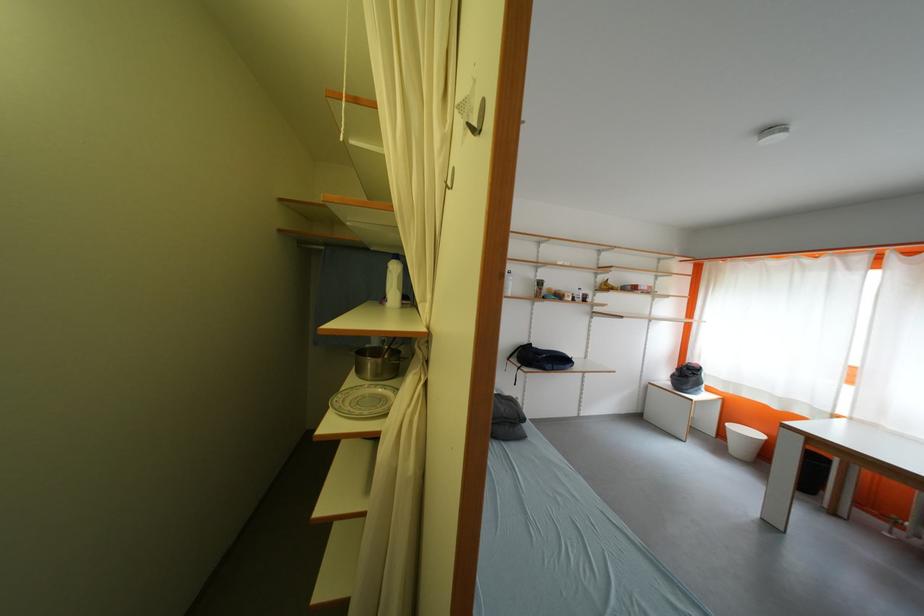
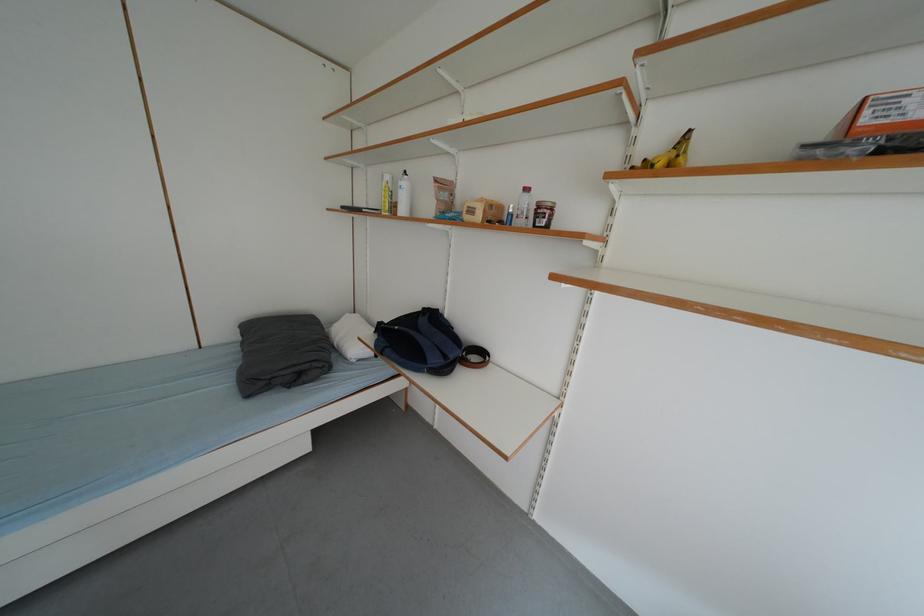
Locate, in the second image, the point that corresponds to [564,370] in the first image.

(396, 354)